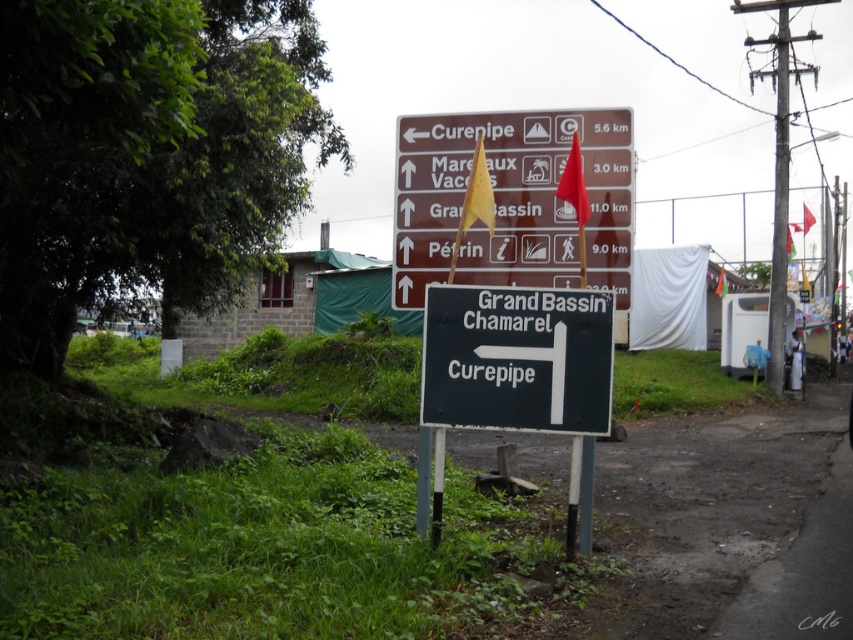
Is brown wooden sign at center thinner than red fabric flag at center?

No, brown wooden sign at center is not thinner than red fabric flag at center.

Is brown wooden sign at center above red fabric flag at center?

Incorrect, brown wooden sign at center is not positioned above red fabric flag at center.

Find the location of a particular element. Image resolution: width=853 pixels, height=640 pixels. brown wooden sign at center is located at coordinates pyautogui.click(x=512, y=200).

Is black plastic sign at center behind red fabric flag at center?

That is False.

Image resolution: width=853 pixels, height=640 pixels. What do you see at coordinates (517, 358) in the screenshot?
I see `black plastic sign at center` at bounding box center [517, 358].

Where is `black plastic sign at center`? This screenshot has width=853, height=640. black plastic sign at center is located at coordinates (517, 358).

Who is shorter, brown wooden sign at center or black plastic sign at center?

Standing shorter between the two is black plastic sign at center.

Is point (409, 240) farther from viewer compared to point (541, 307)?

That is True.

This screenshot has width=853, height=640. I want to click on brown wooden sign at center, so click(x=512, y=200).